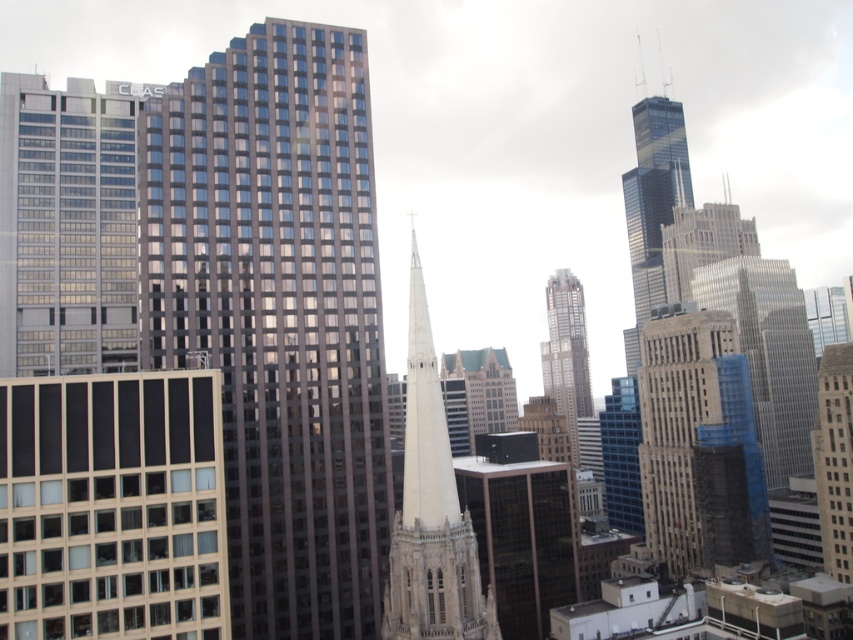
Who is positioned more to the right, glassy steel skyscraper at center or brown brick building at center-right?

From the viewer's perspective, brown brick building at center-right appears more on the right side.

Is glassy steel skyscraper at center below brown brick building at center-right?

No.

The height and width of the screenshot is (640, 853). Find the location of `glassy steel skyscraper at center`. glassy steel skyscraper at center is located at coordinates (277, 314).

This screenshot has height=640, width=853. Identify the location of glassy steel skyscraper at center. (277, 314).

Between matte glass building at left and dark glass skyscraper at center, which one has more height?

dark glass skyscraper at center is taller.

Who is lower down, matte glass building at left or dark glass skyscraper at center?

Positioned lower is dark glass skyscraper at center.

Identify the location of matte glass building at left. This screenshot has height=640, width=853. (67, 225).

I want to click on matte glass building at left, so 67,225.

How much distance is there between white stone spire at center and brown stone tower at right?

The distance of white stone spire at center from brown stone tower at right is 269.20 feet.

The width and height of the screenshot is (853, 640). Find the location of `white stone spire at center`. white stone spire at center is located at coordinates (431, 509).